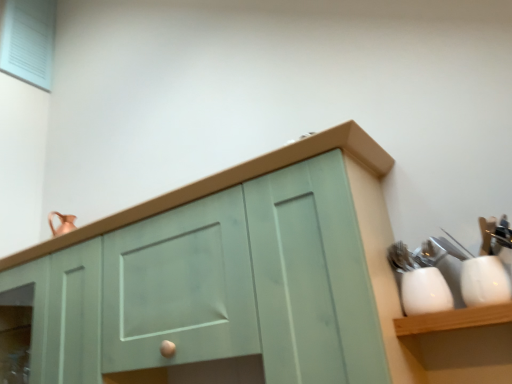
Question: Considering the positions of point (402, 286) and point (349, 147), is point (402, 286) closer or farther from the camera than point (349, 147)?

Choices:
 (A) closer
 (B) farther

Answer: (B)

Question: Considering the positions of white glossy cup at right, which appears as the second tableware when viewed from the right, and matte green cabinet at center in the image, is white glossy cup at right, which appears as the second tableware when viewed from the right, wider or thinner than matte green cabinet at center?

Choices:
 (A) thin
 (B) wide

Answer: (A)

Question: Which object is the closest to the white glossy cup at right, marked as the second tableware in a left-to-right arrangement?

Choices:
 (A) matte green cabinet at center
 (B) white glossy cup at right, which appears as the second tableware when viewed from the right

Answer: (B)

Question: Which object is the farthest from the white glossy cup at right, arranged as the first tableware when viewed from the left?

Choices:
 (A) white glossy cup at right, marked as the second tableware in a left-to-right arrangement
 (B) matte green cabinet at center

Answer: (B)